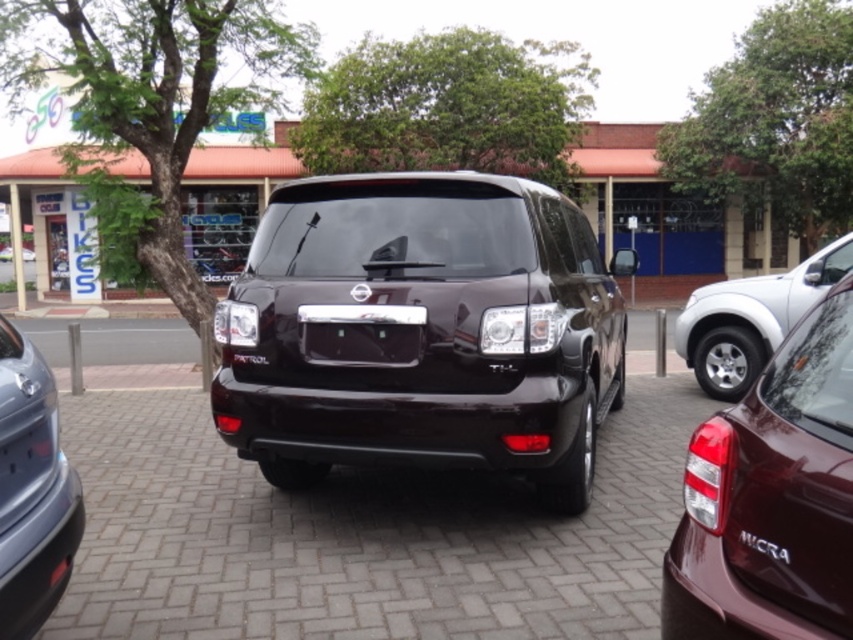
Can you confirm if glossy black minivan at center is positioned to the left of silver metallic pickup truck at right?

Correct, you'll find glossy black minivan at center to the left of silver metallic pickup truck at right.

Can you confirm if glossy black minivan at center is smaller than silver metallic pickup truck at right?

Correct, glossy black minivan at center occupies less space than silver metallic pickup truck at right.

The image size is (853, 640). I want to click on glossy black minivan at center, so click(422, 330).

The image size is (853, 640). In order to click on glossy black minivan at center in this screenshot , I will do `click(422, 330)`.

Is point (843, 602) in front of point (711, 349)?

Yes, point (843, 602) is in front of point (711, 349).

Which is more to the left, maroon glossy micra at lower right or silver metallic pickup truck at right?

From the viewer's perspective, maroon glossy micra at lower right appears more on the left side.

Between point (837, 388) and point (757, 342), which one is positioned behind?

Point (757, 342)

Image resolution: width=853 pixels, height=640 pixels. I want to click on maroon glossy micra at lower right, so click(772, 499).

Is satin silver bumper at lower left in front of silver metallic pickup truck at right?

Yes.

Describe the element at coordinates (32, 490) in the screenshot. The image size is (853, 640). I see `satin silver bumper at lower left` at that location.

Where is `satin silver bumper at lower left`? The image size is (853, 640). satin silver bumper at lower left is located at coordinates (32, 490).